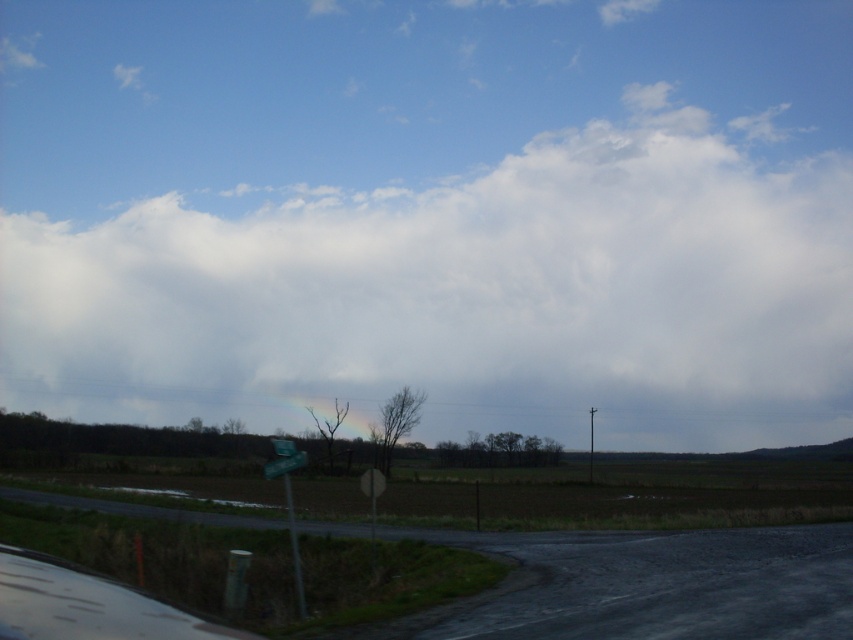
Who is more distant from viewer, (705, 304) or (292, 460)?

The point (705, 304) is behind.

Image resolution: width=853 pixels, height=640 pixels. What do you see at coordinates (466, 296) in the screenshot? I see `white fluffy cloud at upper center` at bounding box center [466, 296].

Image resolution: width=853 pixels, height=640 pixels. What do you see at coordinates (466, 296) in the screenshot?
I see `white fluffy cloud at upper center` at bounding box center [466, 296].

Find the location of `white fluffy cloud at upper center`. white fluffy cloud at upper center is located at coordinates (466, 296).

You are a GUI agent. You are given a task and a screenshot of the screen. Output one action in this format:
    pyautogui.click(x=<x>, y=<y>)
    Task: Click on the green plastic street sign at lower left
    The height and width of the screenshot is (640, 853).
    Given the screenshot: What is the action you would take?
    point(289,500)

Does point (276, 465) come behind point (292, 460)?

No, it is not.

Does point (274, 470) come behind point (267, 472)?

That is True.

You are a GUI agent. You are given a task and a screenshot of the screen. Output one action in this format:
    pyautogui.click(x=<x>, y=<y>)
    Task: Click on the green plastic street sign at lower left
    
    Given the screenshot: What is the action you would take?
    pyautogui.click(x=289, y=500)

In the scene shown: Which is below, rainbow translucent at center or green plastic sign at lower center?

rainbow translucent at center is below.

Identify the location of rainbow translucent at center. The width and height of the screenshot is (853, 640). [328, 422].